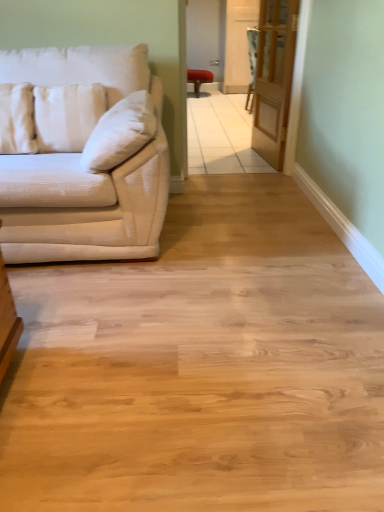
Question: Is white fabric pillow at left, the 2th pillow when ordered from right to left, facing towards matte white couch at left?

Choices:
 (A) yes
 (B) no

Answer: (A)

Question: From a real-world perspective, is white fabric pillow at left, the 2th pillow when ordered from right to left, beneath matte white couch at left?

Choices:
 (A) no
 (B) yes

Answer: (A)

Question: From the image's perspective, does white fabric pillow at left, the 2th pillow when ordered from right to left, appear lower than matte white couch at left?

Choices:
 (A) no
 (B) yes

Answer: (A)

Question: Considering the relative positions of white fabric pillow at left, placed as the 1th pillow when sorted from left to right, and matte white couch at left in the image provided, is white fabric pillow at left, placed as the 1th pillow when sorted from left to right, to the left of matte white couch at left from the viewer's perspective?

Choices:
 (A) no
 (B) yes

Answer: (B)

Question: Does white fabric pillow at left, the 2th pillow when ordered from right to left, have a smaller size compared to matte white couch at left?

Choices:
 (A) no
 (B) yes

Answer: (B)

Question: Is white fabric pillow at left, the 2th pillow when ordered from right to left, further to camera compared to matte white couch at left?

Choices:
 (A) no
 (B) yes

Answer: (B)

Question: From a real-world perspective, is matte white couch at left located higher than white fabric pillow at left, placed as the 1th pillow when sorted from left to right?

Choices:
 (A) no
 (B) yes

Answer: (A)

Question: Does matte white couch at left have a greater height compared to white fabric pillow at left, placed as the 1th pillow when sorted from left to right?

Choices:
 (A) no
 (B) yes

Answer: (B)

Question: Is matte white couch at left next to white fabric pillow at left, the 2th pillow when ordered from right to left, and touching it?

Choices:
 (A) no
 (B) yes

Answer: (A)

Question: Can you confirm if matte white couch at left is bigger than white fabric pillow at left, placed as the 1th pillow when sorted from left to right?

Choices:
 (A) yes
 (B) no

Answer: (A)

Question: Is matte white couch at left not near white fabric pillow at left, the 2th pillow when ordered from right to left?

Choices:
 (A) yes
 (B) no

Answer: (B)

Question: Considering the relative sizes of matte white couch at left and white fabric pillow at left, placed as the 1th pillow when sorted from left to right, in the image provided, is matte white couch at left shorter than white fabric pillow at left, placed as the 1th pillow when sorted from left to right,?

Choices:
 (A) yes
 (B) no

Answer: (B)

Question: Can you confirm if velvet-like beige armchair at center is taller than white fabric pillow at left, the 2th pillow when ordered from right to left?

Choices:
 (A) no
 (B) yes

Answer: (B)